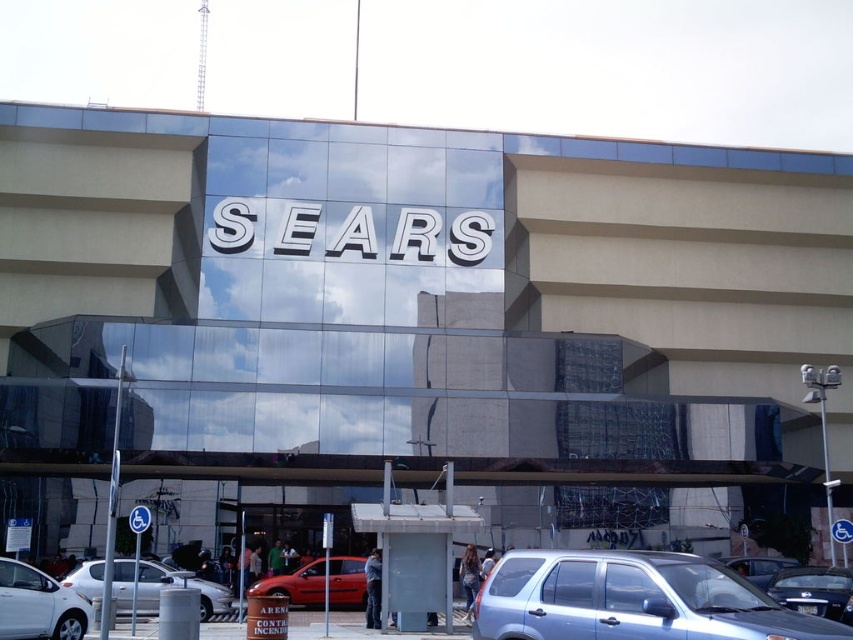
Question: Considering the real-world distances, which object is closest to the metallic silver sedan at lower right?

Choices:
 (A) satin blue suv at lower right
 (B) shiny red car at center

Answer: (A)

Question: Which of the following is the farthest from the observer?

Choices:
 (A) (315, 582)
 (B) (122, 600)
 (C) (10, 604)

Answer: (A)

Question: Estimate the real-world distances between objects in this image. Which object is closer to the shiny red car at center?

Choices:
 (A) silver metallic sedan at lower left
 (B) satin blue suv at lower right
 (C) metallic silver sedan at lower right
 (D) white glossy sedan at lower left

Answer: (A)

Question: Is satin blue suv at lower right behind silver metallic sedan at lower left?

Choices:
 (A) yes
 (B) no

Answer: (B)

Question: In this image, where is shiny red car at center located relative to metallic silver sedan at lower right?

Choices:
 (A) below
 (B) above

Answer: (A)

Question: Observing the image, what is the correct spatial positioning of satin blue suv at lower right in reference to metallic silver sedan at lower right?

Choices:
 (A) left
 (B) right

Answer: (A)